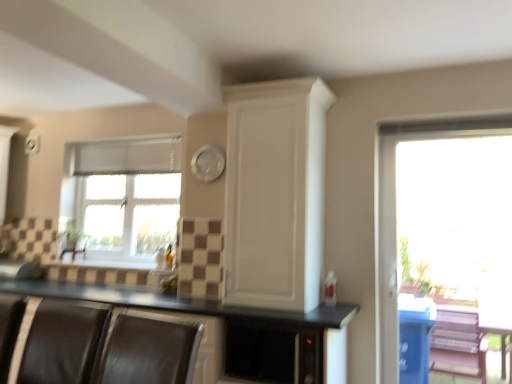
You are a GUI agent. You are given a task and a screenshot of the screen. Output one action in this format:
    pyautogui.click(x=<x>, y=<y>)
    Task: Click on the free point above transparent glass window at right, the 2th window when ordered from left to right (from a real-world perspective)
    This screenshot has height=384, width=512.
    Given the screenshot: What is the action you would take?
    pyautogui.click(x=454, y=137)